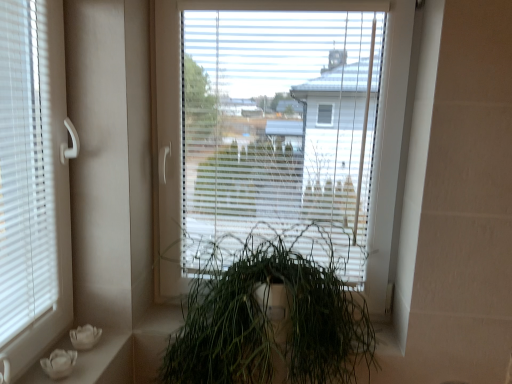
Locate an element on the screen. Image resolution: width=512 pixels, height=384 pixels. transparent plastic window at center is located at coordinates (280, 132).

Measure the distance between white matte flower pots at lower left and camera.

They are 1.10 meters apart.

The image size is (512, 384). I want to click on white matte flower pots at lower left, so click(95, 363).

Measure the distance between point (219, 278) and camera.

A distance of 4.66 feet exists between point (219, 278) and camera.

Locate an element on the screen. The width and height of the screenshot is (512, 384). transparent plastic window at center is located at coordinates (280, 132).

Consider the image. Is transparent plastic window at center to the left of white matte flower pots at lower left from the viewer's perspective?

No, transparent plastic window at center is not to the left of white matte flower pots at lower left.

Is transparent plastic window at center placed right next to white matte flower pots at lower left?

No, transparent plastic window at center is not in contact with white matte flower pots at lower left.

Between transparent plastic window at center and white matte flower pots at lower left, which one is positioned behind?

transparent plastic window at center is further away from the camera.

Considering the positions of point (177, 143) and point (85, 358), is point (177, 143) closer or farther from the camera than point (85, 358)?

Point (177, 143).

Which is behind, point (337, 143) or point (346, 314)?

The point (337, 143) is farther from the camera.

Is transparent plastic window at center wider than green matte plant at center?

In fact, transparent plastic window at center might be narrower than green matte plant at center.

From a real-world perspective, is transparent plastic window at center under green matte plant at center?

No, from a real-world perspective, transparent plastic window at center is not beneath green matte plant at center.

Which object is more forward, transparent plastic window at center or green matte plant at center?

green matte plant at center is more forward.

Does green matte plant at center have a smaller size compared to white matte flower pots at lower left?

No, green matte plant at center is not smaller than white matte flower pots at lower left.

What's the angular difference between green matte plant at center and white matte flower pots at lower left's facing directions?

90 degrees separate the facing orientations of green matte plant at center and white matte flower pots at lower left.

Is green matte plant at center touching white matte flower pots at lower left?

No, green matte plant at center is not beside white matte flower pots at lower left.

Which is further, (x=200, y=370) or (x=85, y=359)?

The point (x=200, y=370) is farther from the camera.

Considering the sizes of objects white matte flower pots at lower left and transparent plastic window at center in the image provided, who is smaller, white matte flower pots at lower left or transparent plastic window at center?

white matte flower pots at lower left.

Which is more to the right, white matte flower pots at lower left or transparent plastic window at center?

transparent plastic window at center is more to the right.

From the image's perspective, which is above, white matte flower pots at lower left or transparent plastic window at center?

transparent plastic window at center is shown above in the image.

Is white matte flower pots at lower left further to the viewer compared to transparent plastic window at center?

No, it is not.

Is white matte flower pots at lower left to the right of green matte plant at center from the viewer's perspective?

No.

Which of these two, white matte flower pots at lower left or green matte plant at center, stands taller?

green matte plant at center.

From a real-world perspective, which is physically above, white matte flower pots at lower left or green matte plant at center?

green matte plant at center, from a real-world perspective.

Would you consider green matte plant at center to be distant from transparent plastic window at center?

They are positioned close to each other.

Is green matte plant at center aimed at transparent plastic window at center?

No, green matte plant at center is not turned towards transparent plastic window at center.

Is green matte plant at center taller than transparent plastic window at center?

Incorrect, the height of green matte plant at center is not larger of that of transparent plastic window at center.

Where is `window on the right of the white matte flower pots at lower left`? window on the right of the white matte flower pots at lower left is located at coordinates (280, 132).

Find the location of a particular element. The height and width of the screenshot is (384, 512). window behind the green matte plant at center is located at coordinates (280, 132).

When comparing their distances from white matte flower pots at lower left, does green matte plant at center or transparent plastic window at center seem further?

Based on the image, transparent plastic window at center appears to be further to white matte flower pots at lower left.

Based on the photo, from the image, which object appears to be farther from white matte flower pots at lower left, transparent plastic window at center or green matte plant at center?

Among the two, transparent plastic window at center is located further to white matte flower pots at lower left.

Looking at the image, which one is located closer to transparent plastic window at center, white matte flower pots at lower left or green matte plant at center?

green matte plant at center.

When comparing their distances from transparent plastic window at center, does green matte plant at center or white matte flower pots at lower left seem closer?

The object closer to transparent plastic window at center is green matte plant at center.

From the picture: Looking at the image, which one is located further to green matte plant at center, transparent plastic window at center or white matte flower pots at lower left?

white matte flower pots at lower left is positioned further to the anchor green matte plant at center.

Considering their positions, is white matte flower pots at lower left positioned further to green matte plant at center than transparent plastic window at center?

Among the two, white matte flower pots at lower left is located further to green matte plant at center.

Locate an element on the screen. houseplant situated between white matte flower pots at lower left and transparent plastic window at center from left to right is located at coordinates (271, 315).